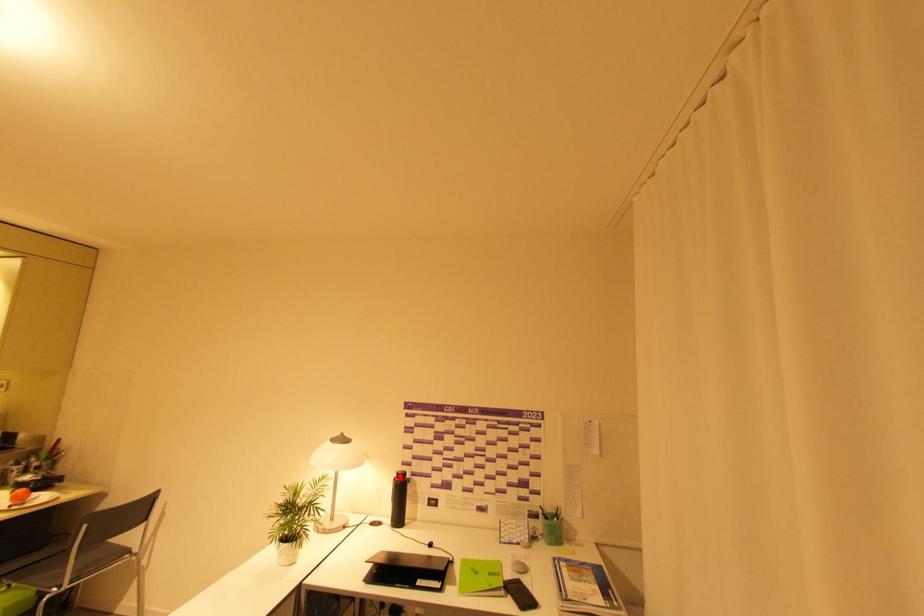
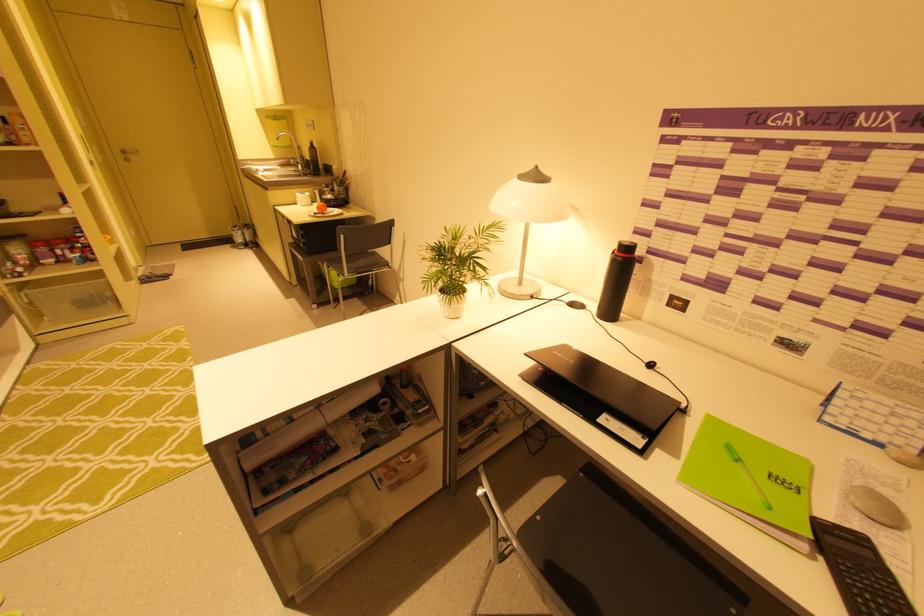
Question: I am providing you with two images of the same scene from different viewpoints. In image1, a red point is highlighted. Considering the same 3D point in image2, which of the following is correct?

Choices:
 (A) It is closer
 (B) It is farther

Answer: (A)